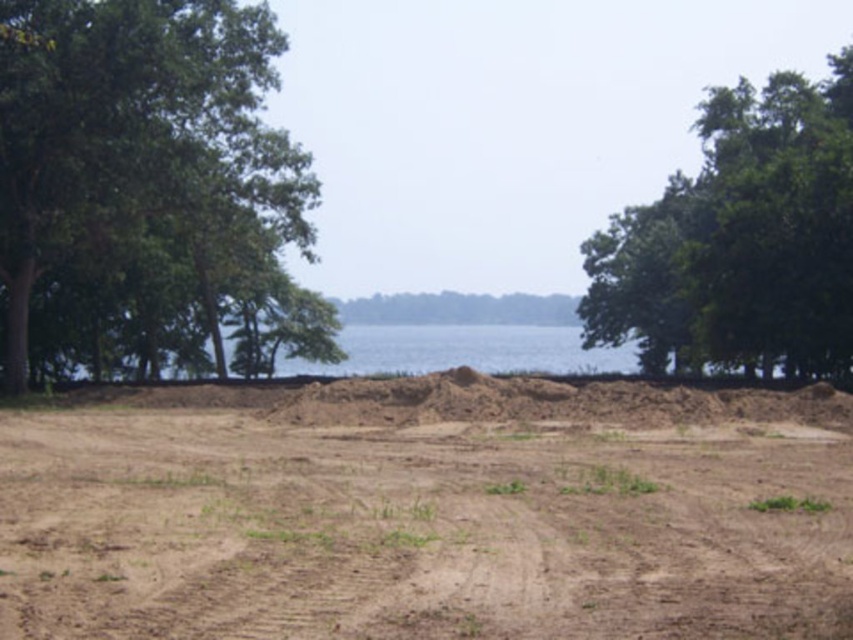
Question: Estimate the real-world distances between objects in this image. Which object is farther from the brown sandy dirt at center?

Choices:
 (A) green leafy tree at upper right
 (B) green leafy tree at left

Answer: (A)

Question: Which of the following is the farthest from the observer?

Choices:
 (A) (113, 42)
 (B) (845, 326)

Answer: (B)

Question: Does green leafy tree at left have a smaller size compared to green leafy tree at upper right?

Choices:
 (A) no
 (B) yes

Answer: (B)

Question: Can you confirm if brown sandy dirt at center is wider than green leafy tree at left?

Choices:
 (A) no
 (B) yes

Answer: (B)

Question: Considering the real-world distances, which object is farthest from the brown sandy dirt at center?

Choices:
 (A) green leafy tree at left
 (B) green leafy tree at upper right

Answer: (B)

Question: Does brown sandy dirt at center appear under green leafy tree at left?

Choices:
 (A) no
 (B) yes

Answer: (B)